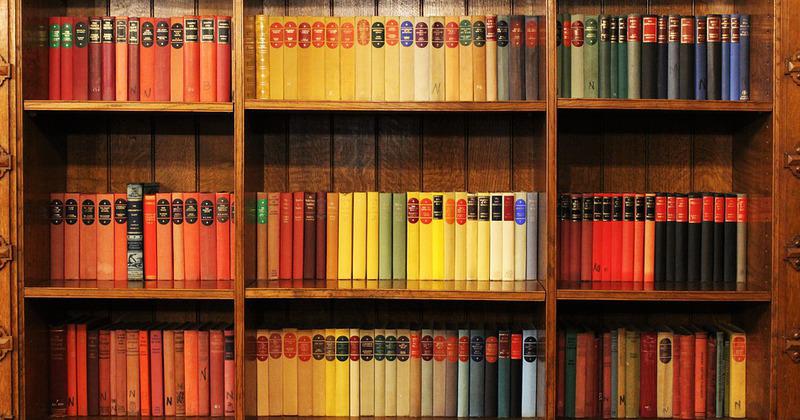
Identify the location of green books. (504, 58), (564, 62), (576, 70), (592, 69), (604, 54), (612, 68), (622, 60), (396, 236), (384, 233), (570, 359).